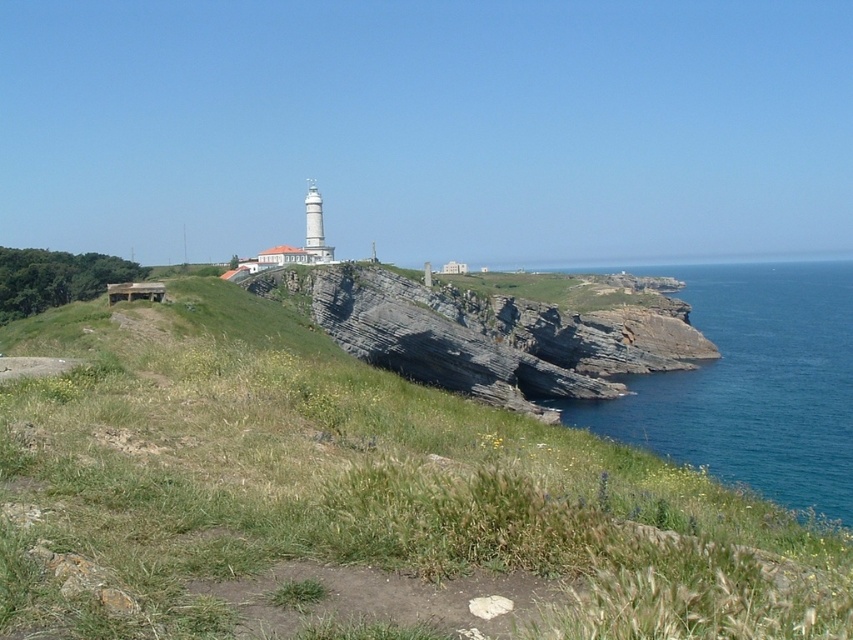
Between green grassy at center and rocky cliff at center, which one is positioned lower?

green grassy at center

Does green grassy at center appear over rocky cliff at center?

Incorrect, green grassy at center is not positioned above rocky cliff at center.

Does point (274, 582) come in front of point (360, 284)?

Yes, point (274, 582) is in front of point (360, 284).

Where is `green grassy at center`? The width and height of the screenshot is (853, 640). green grassy at center is located at coordinates (349, 492).

Between point (836, 275) and point (485, 384), which one is positioned behind?

The point (836, 275) is behind.

Is point (830, 333) positioned behind point (491, 371)?

Yes, point (830, 333) is farther from viewer.

Locate an element on the screen. blue water at right is located at coordinates (752, 381).

Can you confirm if green grassy at center is positioned to the left of blue water at right?

Correct, you'll find green grassy at center to the left of blue water at right.

Between green grassy at center and blue water at right, which one appears on the right side from the viewer's perspective?

blue water at right

Between point (432, 426) and point (735, 280), which one is positioned in front?

Point (432, 426) is more forward.

Identify the location of green grassy at center. Image resolution: width=853 pixels, height=640 pixels. (349, 492).